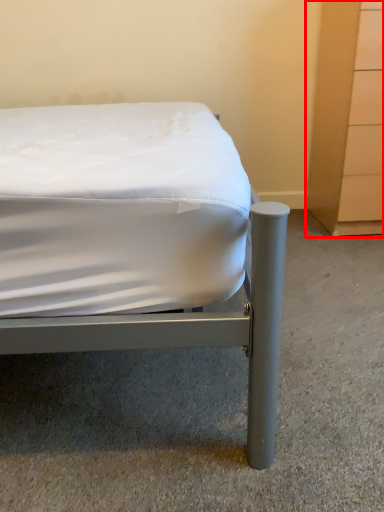
Question: Where is dresser (annotated by the red box) located in relation to bed in the image?

Choices:
 (A) left
 (B) right

Answer: (B)